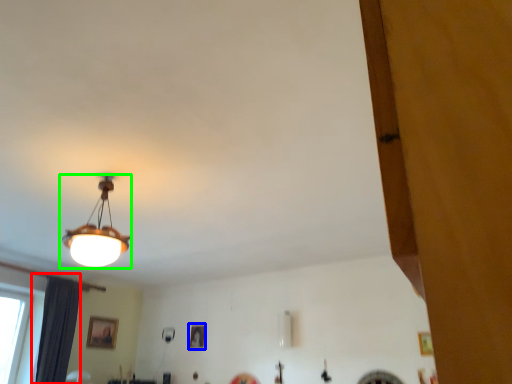
Question: Which is farther away from curtain (highlighted by a red box)? picture frame (highlighted by a blue box) or lamp (highlighted by a green box)?

Choices:
 (A) picture frame
 (B) lamp

Answer: (B)